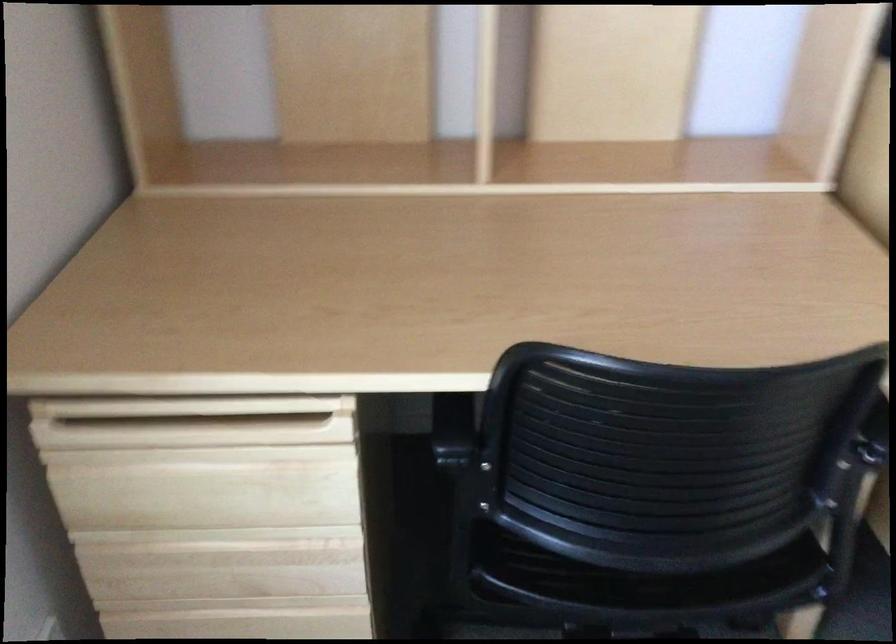
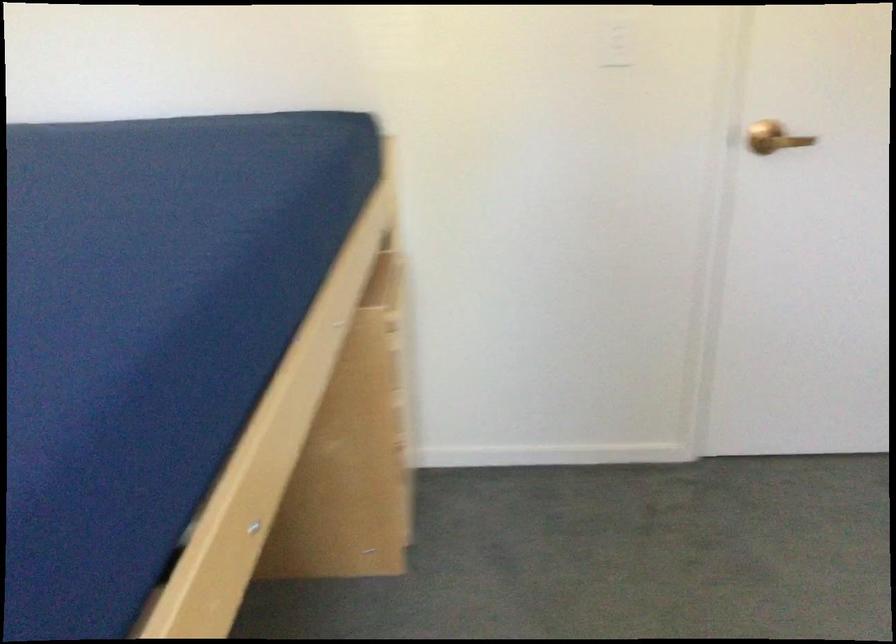
The images are taken continuously from a first-person perspective. In which direction is your viewpoint rotating?

The rotation direction of the camera is right-down.